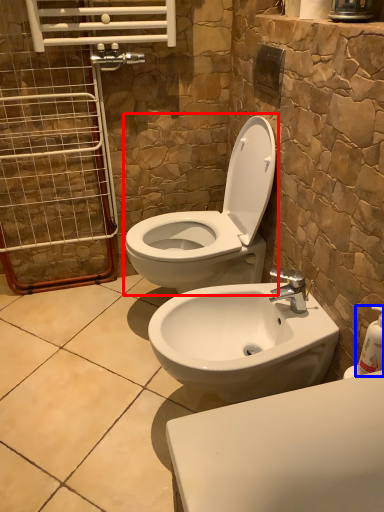
Question: Which object is further to the camera taking this photo, toilet (highlighted by a red box) or soap dispenser (highlighted by a blue box)?

Choices:
 (A) toilet
 (B) soap dispenser

Answer: (A)